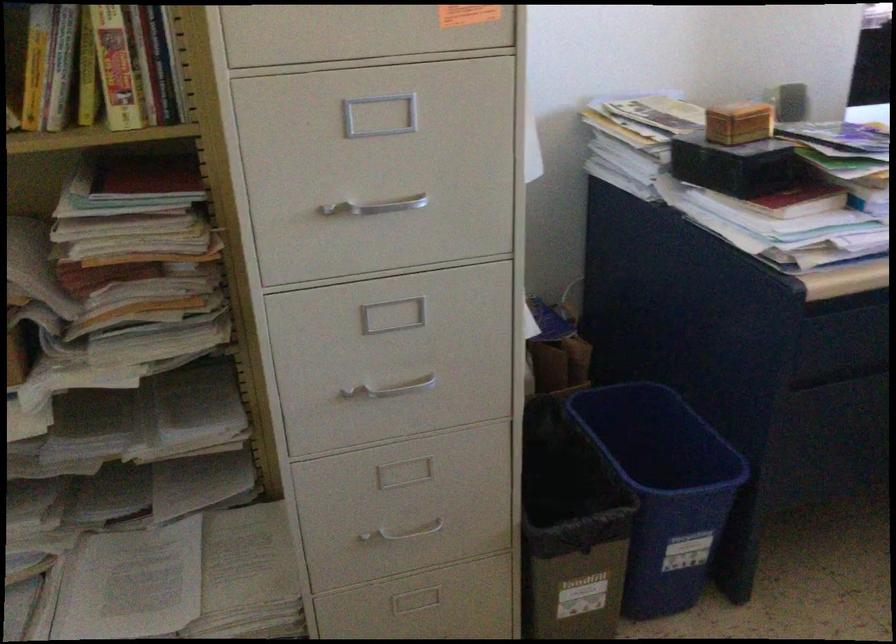
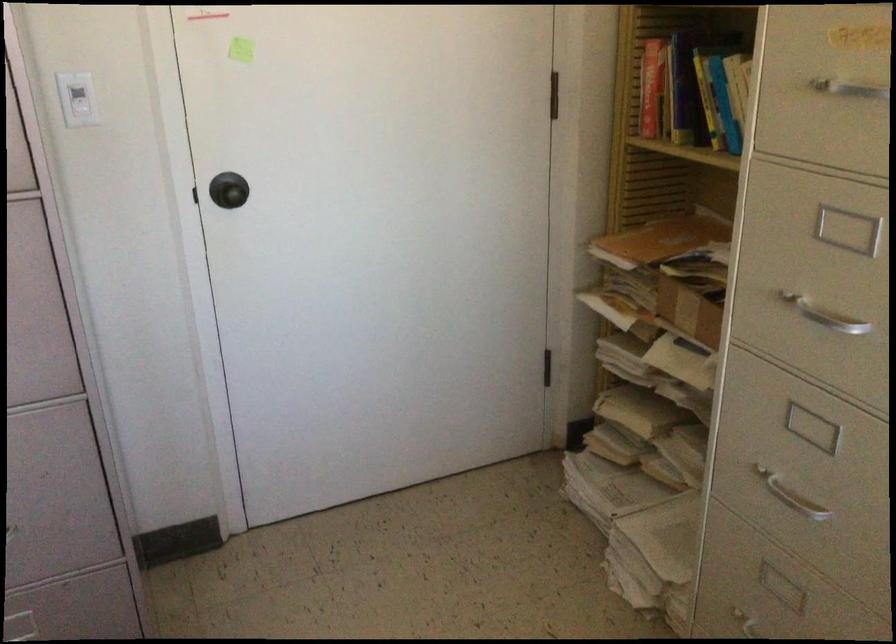
Locate, in the second image, the point that corresponds to pixel 398 522 in the first image.

(754, 625)